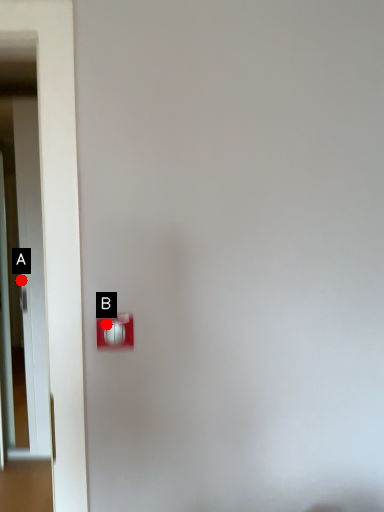
Question: Two points are circled on the image, labeled by A and B beside each circle. Which point is closer to the camera taking this photo?

Choices:
 (A) A is closer
 (B) B is closer

Answer: (B)